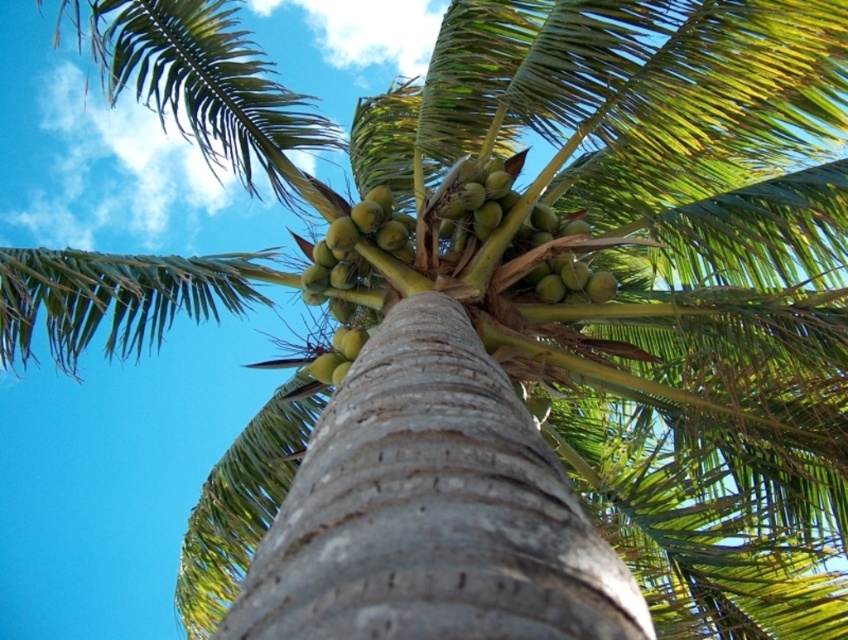
Question: Can you confirm if green matte coconuts at upper center is positioned below green matte coconuts at center?

Choices:
 (A) no
 (B) yes

Answer: (A)

Question: Does green matte coconuts at upper center appear on the right side of green matte coconuts at center?

Choices:
 (A) no
 (B) yes

Answer: (B)

Question: Which point is closer to the camera?

Choices:
 (A) (311, 273)
 (B) (503, 259)

Answer: (B)

Question: Which object is closer to the camera taking this photo?

Choices:
 (A) green matte coconuts at center
 (B) green matte coconuts at upper center

Answer: (B)

Question: Does green matte coconuts at upper center come in front of green matte coconuts at center?

Choices:
 (A) no
 (B) yes

Answer: (B)